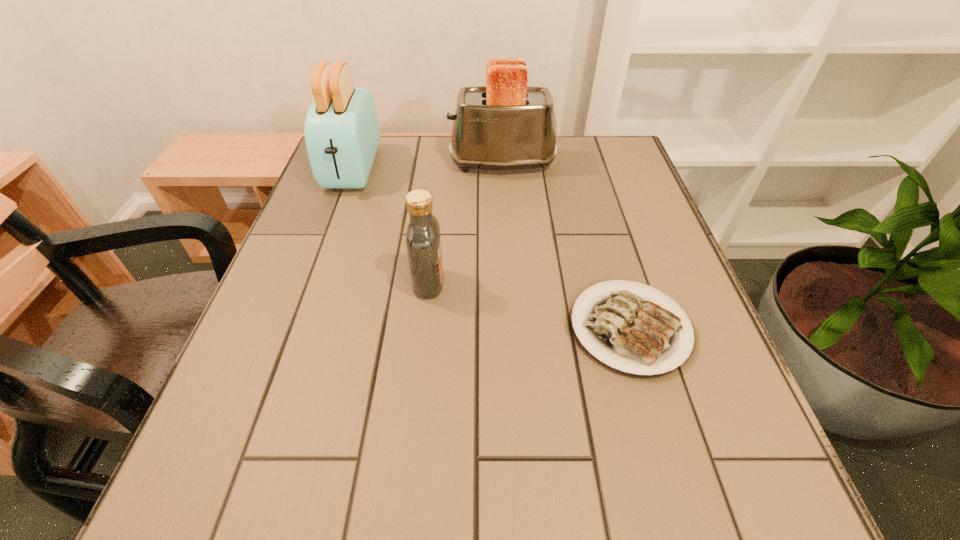
Where is `object at the left edge`? This screenshot has width=960, height=540. object at the left edge is located at coordinates (342, 134).

Find the location of a particular element. object located in the right edge section of the desktop is located at coordinates (631, 332).

I want to click on object positioned at the far left corner, so click(x=342, y=134).

In the image, there is a desktop. Where is `free space at the far edge`? The image size is (960, 540). free space at the far edge is located at coordinates (510, 173).

At what (x,y) coordinates should I click in order to perform the action: click on free space at the left edge. Please return your answer as a coordinate pair (x, y). Looking at the image, I should click on (341, 231).

Identify the location of vacant position at the right edge of the desktop. (645, 235).

Where is `vacant area at the far left corner of the desktop`? This screenshot has width=960, height=540. vacant area at the far left corner of the desktop is located at coordinates (376, 181).

In the image, there is a desktop. Where is `free space at the far right corner`? This screenshot has width=960, height=540. free space at the far right corner is located at coordinates (612, 146).

Where is `vacant area between the plate and the left toaster`? vacant area between the plate and the left toaster is located at coordinates (492, 248).

The height and width of the screenshot is (540, 960). I want to click on vacant area that lies between the vodka and the left toaster, so click(x=391, y=226).